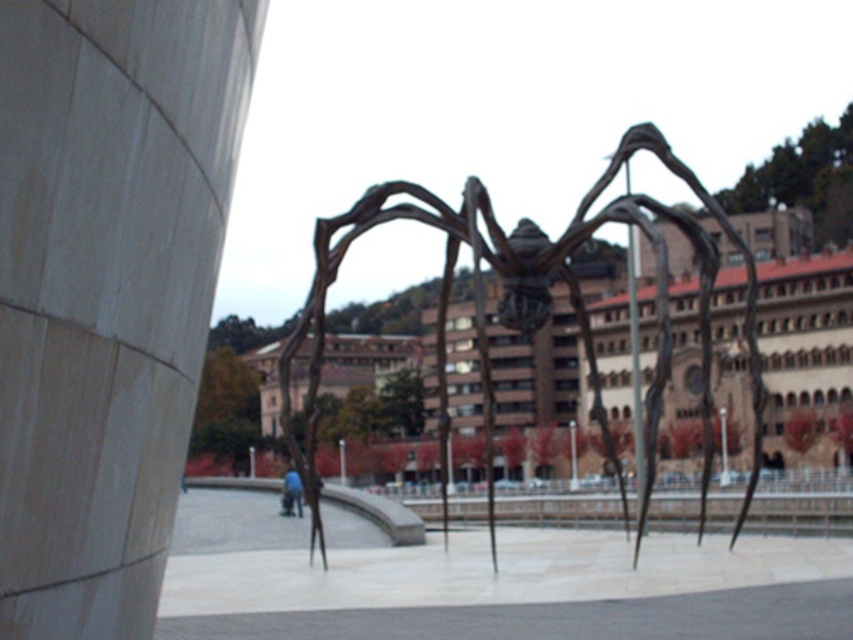
You are an artist trying to place a new sculpture in the center of the room. You have a bronze sculpture at center and blue fabric pants at center. Which object is wider?

The bronze sculpture at center is wider than the blue fabric pants at center according to the description provided.

You are an artist planning to photograph the bronze sculpture at center and the blue fabric pants at center. Since you want to emphasize the size difference between them, which object should you position closer to the camera to achieve this effect?

To emphasize the size difference between the bronze sculpture at center and the blue fabric pants at center, you should position the smaller object, the blue fabric pants at center, closer to the camera. This will make it appear larger in the photo compared to the bronze sculpture at center, which is naturally bigger but placed farther away.